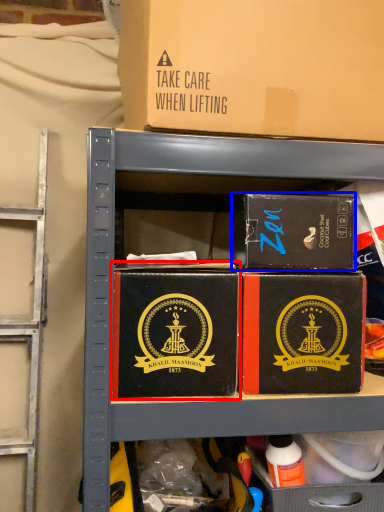
Question: Which of the following is the farthest to the observer, box (highlighted by a red box) or box (highlighted by a blue box)?

Choices:
 (A) box
 (B) box

Answer: (B)